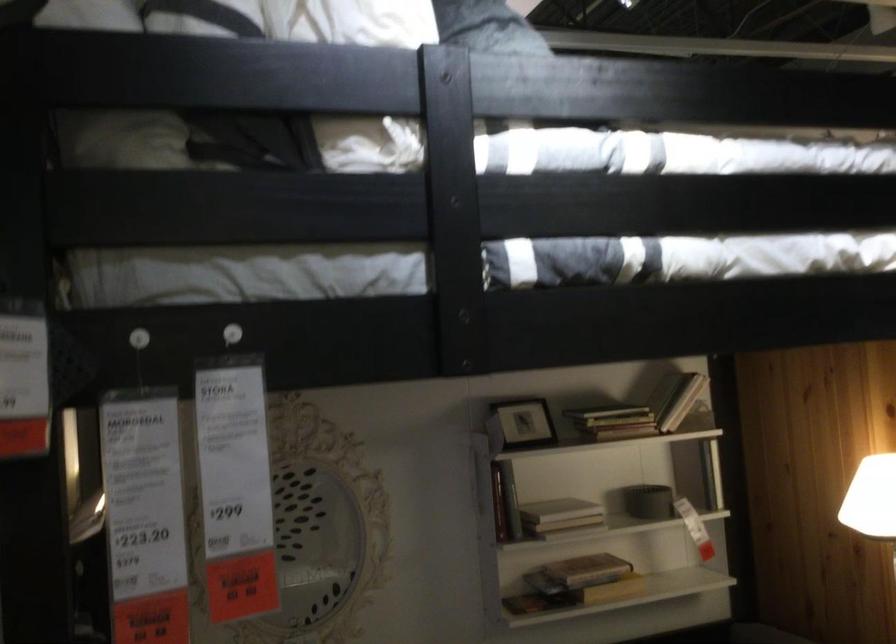
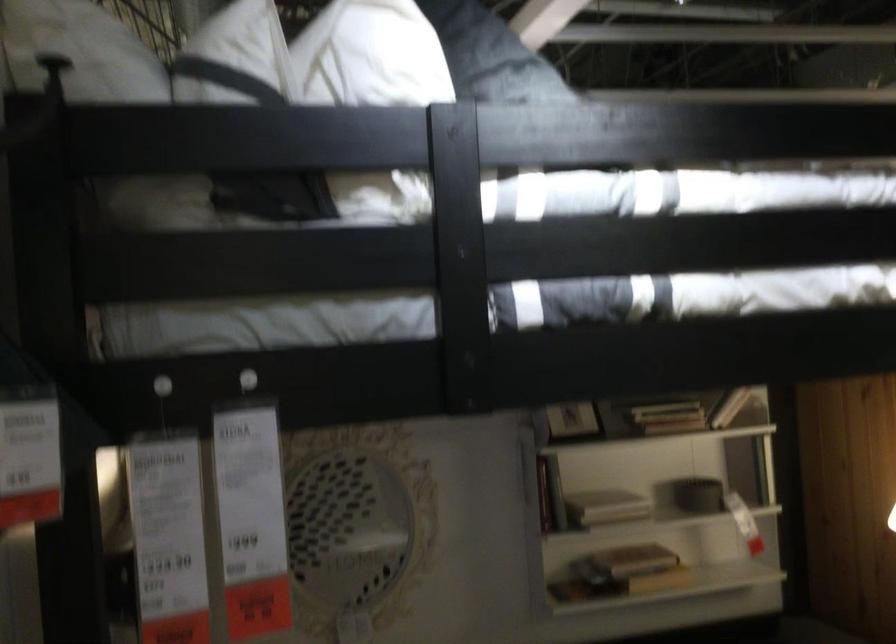
Question: The camera is either moving clockwise (left) or counter-clockwise (right) around the object. The first image is from the beginning of the video and the second image is from the end. Is the camera moving left or right when shooting the video?

Choices:
 (A) Left
 (B) Right

Answer: (B)